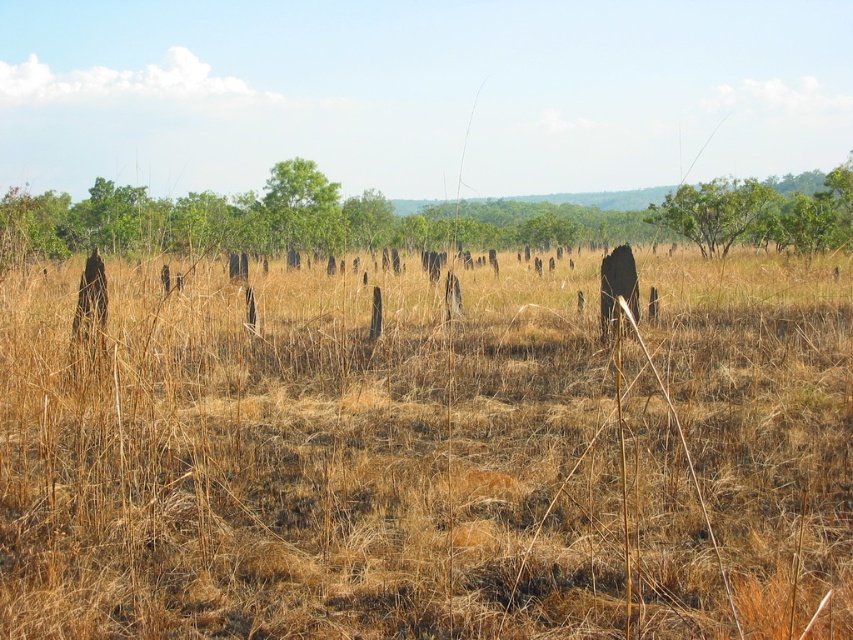
You are standing at the origin point in the savanna scene. There is a point marked at coordinates (x=714, y=211). Based on the description, what object does this point correspond to?

The point corresponds to the green leafy tree at upper right.

You are a wildlife photographer standing at the center of the savanna. You want to capture a photo that includes both the brown dry grass at center and the green leafy tree at upper right. Based on their distance, can you estimate how far apart these two elements are to frame your shot properly?

The brown dry grass at center is 58.39 feet away from the green leafy tree at upper right, so you should frame your shot to account for this distance to include both elements in the composition.

You are an ecologist studying the savanna ecosystem. You observe the brown wood tree at center and the green matte tree at upper center. Which tree would cast a longer shadow at noon when the sun is directly overhead?

The brown wood tree at center is taller than the green matte tree at upper center, so it would cast a longer shadow at noon when the sun is directly overhead.